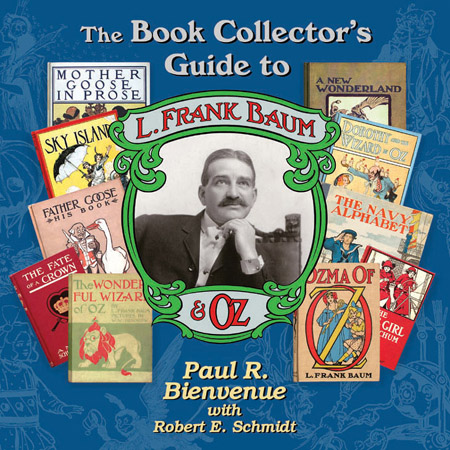
Image resolution: width=450 pixels, height=450 pixels. I want to click on chair, so click(286, 267).